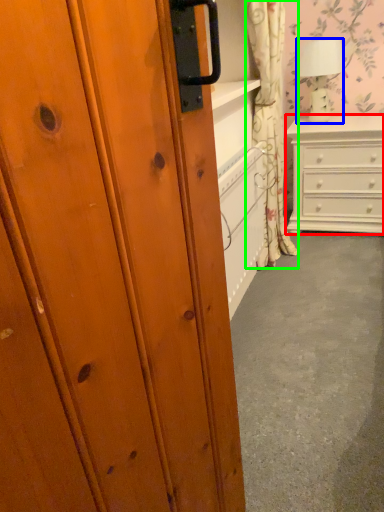
Question: Considering the real-world distances, which object is closest to chest of drawers (highlighted by a red box)? lamp (highlighted by a blue box) or curtain (highlighted by a green box).

Choices:
 (A) lamp
 (B) curtain

Answer: (A)